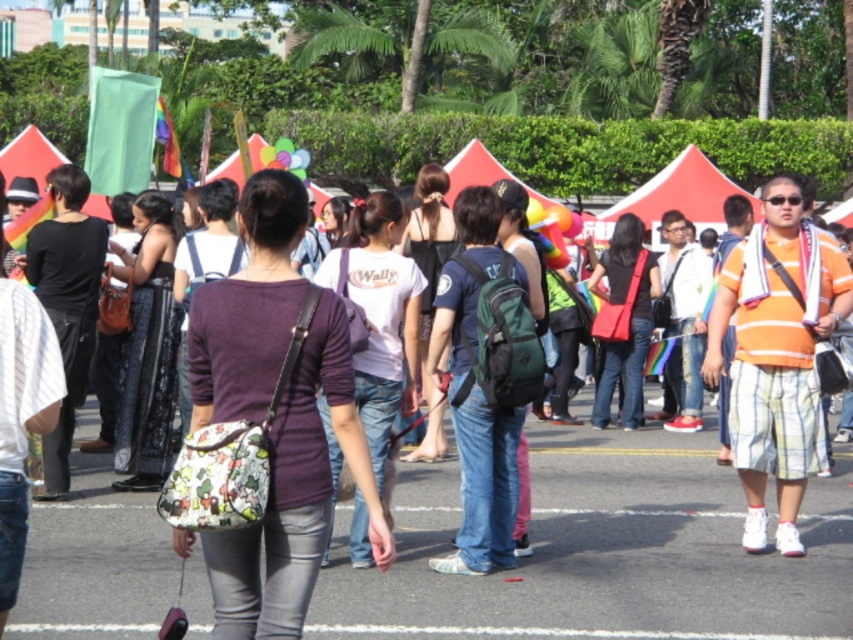
Question: Is white matte shirt at center smaller than black satin dress at center?

Choices:
 (A) no
 (B) yes

Answer: (A)

Question: Which object is the closest to the black matte dress at center?

Choices:
 (A) matte purple shirt at center
 (B) black satin dress at center
 (C) matte white t-shirt at center

Answer: (B)

Question: Which object is the farthest from the matte purple shirt at center?

Choices:
 (A) white matte shirt at center
 (B) black matte dress at center

Answer: (B)

Question: Does black satin dress at center have a lesser width compared to black matte dress at center?

Choices:
 (A) no
 (B) yes

Answer: (A)

Question: Is white matte shirt at center above matte red bag at center?

Choices:
 (A) no
 (B) yes

Answer: (A)

Question: Based on their relative distances, which object is farther from the matte purple shirt at center?

Choices:
 (A) white matte shirt at center
 (B) black matte dress at center
 (C) matte red bag at center
 (D) matte white t-shirt at center

Answer: (D)